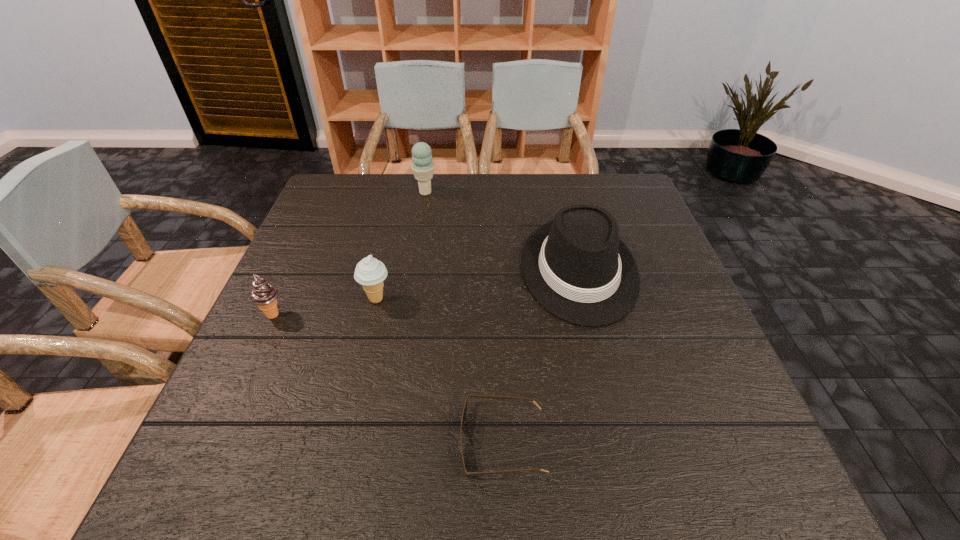
You are a GUI agent. You are given a task and a screenshot of the screen. Output one action in this format:
    pyautogui.click(x=<x>, y=<y>)
    Task: Click on the third object from left to right
    Image resolution: width=960 pixels, height=540 pixels.
    Given the screenshot: What is the action you would take?
    pyautogui.click(x=422, y=167)

Locate an element on the screen. This screenshot has height=540, width=960. the farthest object is located at coordinates (422, 167).

This screenshot has width=960, height=540. I want to click on fedora, so click(x=576, y=266).

Find the location of `the second icecream from left to right`. the second icecream from left to right is located at coordinates point(370,273).

Where is `the leftmost icecream`? the leftmost icecream is located at coordinates (264, 295).

In order to click on the nearest object in this screenshot , I will do `click(464, 412)`.

Where is `the shortest object`? The width and height of the screenshot is (960, 540). the shortest object is located at coordinates (x=464, y=412).

Find the location of a particular element. free space located on the right of the farthest object is located at coordinates (453, 192).

At what (x,y) coordinates should I click in order to perform the action: click on free space located on the front-facing side of the fedora. Please return your answer as a coordinate pair (x, y). Looking at the image, I should click on (598, 349).

I want to click on free space located on the front of the second icecream from left to right, so click(x=362, y=362).